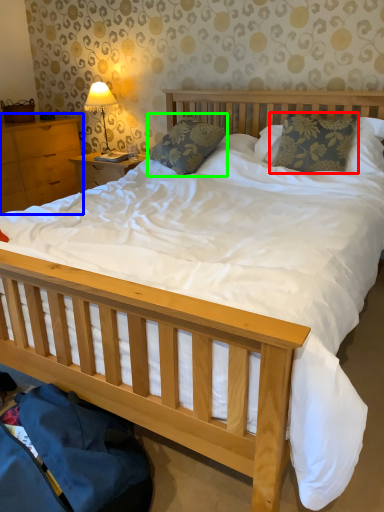
Question: Which object is positioned farthest from pillow (highlighted by a red box)? Select from nightstand (highlighted by a blue box) and pillow (highlighted by a green box).

Choices:
 (A) nightstand
 (B) pillow

Answer: (A)